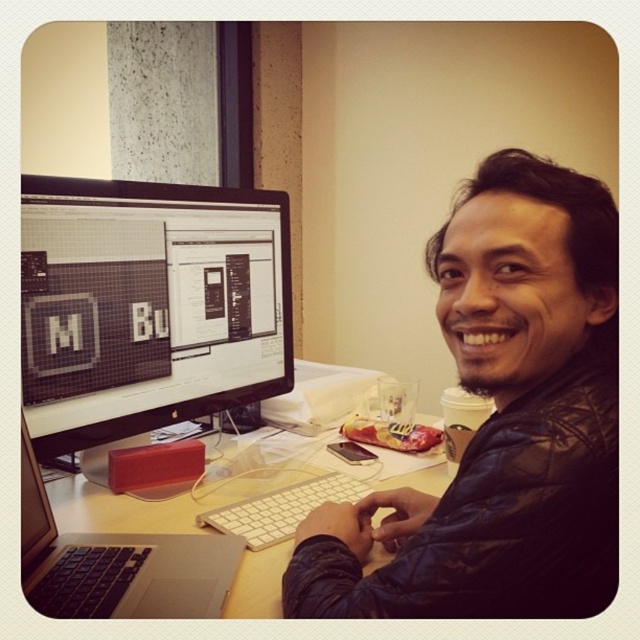
Is point (440, 593) farther from viewer compared to point (292, 460)?

No, it is in front of (292, 460).

Who is more forward, (486,488) or (52,502)?

Point (486,488) is in front.

Who is more forward, [593,387] or [268,605]?

Positioned in front is point [593,387].

You are a GUI agent. You are given a task and a screenshot of the screen. Output one action in this format:
    pyautogui.click(x=<x>, y=<y>)
    Task: Click on the leather jacket at center
    This screenshot has width=640, height=640.
    Given the screenshot: What is the action you would take?
    pyautogui.click(x=500, y=420)

Is point (74, 552) more distant than point (252, 531)?

No.

Is point (26, 577) farther from camera compared to point (337, 484)?

No, it is in front of (337, 484).

You are a GUI agent. You are given a task and a screenshot of the screen. Output one action in this format:
    pyautogui.click(x=<x>, y=<y>)
    Task: Click on the silver metallic laptop at lower left
    
    Given the screenshot: What is the action you would take?
    pyautogui.click(x=116, y=564)

Does leather jacket at center have a lesser width compared to silver metallic laptop at lower left?

No.

Is leather jacket at center to the left of silver metallic laptop at lower left from the viewer's perspective?

Incorrect, leather jacket at center is not on the left side of silver metallic laptop at lower left.

Does point (540, 234) come closer to viewer compared to point (68, 557)?

Yes.

The height and width of the screenshot is (640, 640). I want to click on leather jacket at center, so click(x=500, y=420).